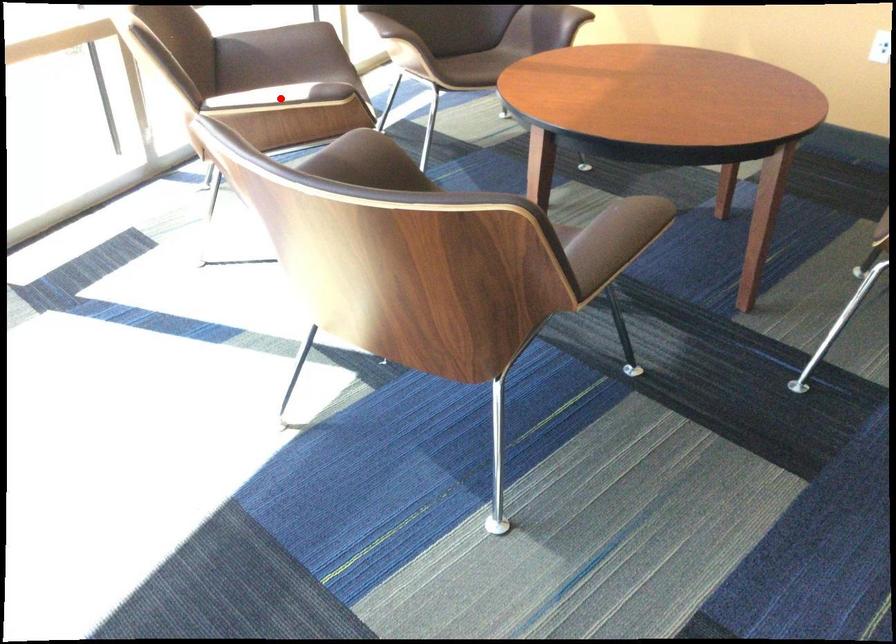
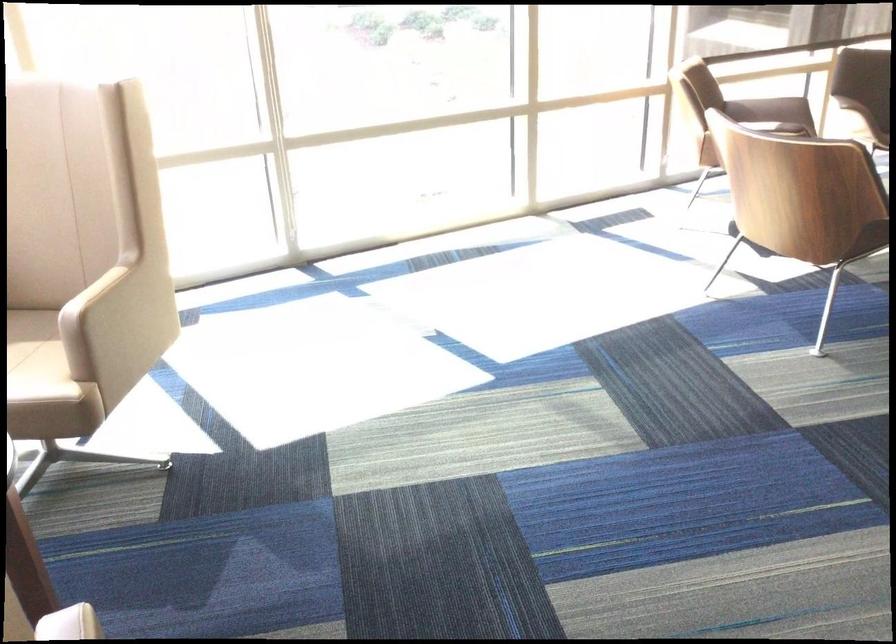
Question: I am providing you with two images of the same scene from different viewpoints. A red point is marked on the first image. At the location where the point appears in image 1, is it still visible in image 2?

Choices:
 (A) Yes
 (B) No

Answer: (B)